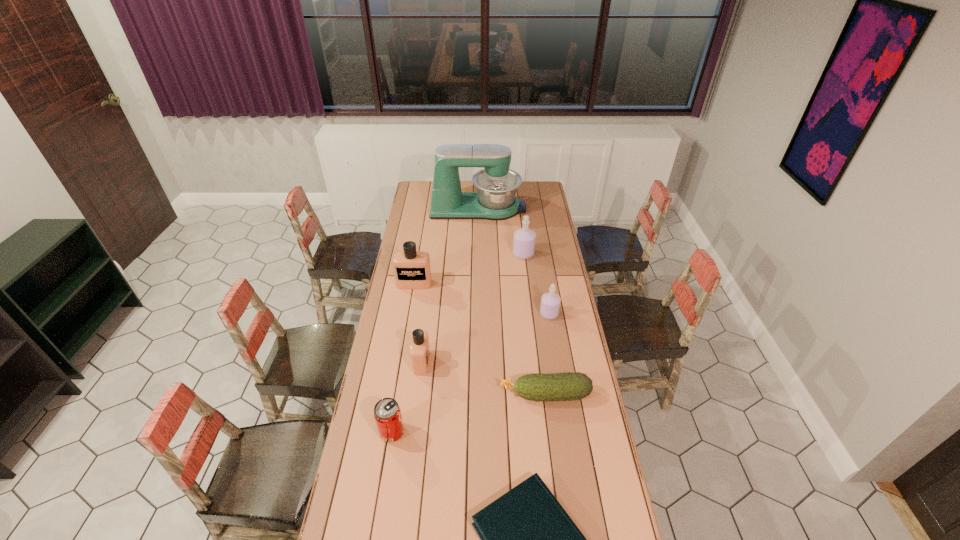
The image size is (960, 540). In order to click on mixer in this screenshot , I will do `click(496, 185)`.

This screenshot has width=960, height=540. Identify the location of the tallest object. (496, 185).

Image resolution: width=960 pixels, height=540 pixels. What are the coordinates of `the second farthest object` in the screenshot? It's located at (524, 239).

Locate an element on the screen. Image resolution: width=960 pixels, height=540 pixels. the bigger purple perfume is located at coordinates (524, 239).

Identify the location of the second farthest perfume. Image resolution: width=960 pixels, height=540 pixels. click(412, 270).

Locate an element on the screen. the bigger beige perfume is located at coordinates (412, 270).

The height and width of the screenshot is (540, 960). In order to click on the third farthest perfume in this screenshot , I will do `click(550, 302)`.

Where is `the fourth farthest object`? This screenshot has height=540, width=960. the fourth farthest object is located at coordinates (550, 302).

Where is `the fourth nearest object`? This screenshot has width=960, height=540. the fourth nearest object is located at coordinates coord(419,350).

Find the location of `the nearer beige perfume`. the nearer beige perfume is located at coordinates (419, 350).